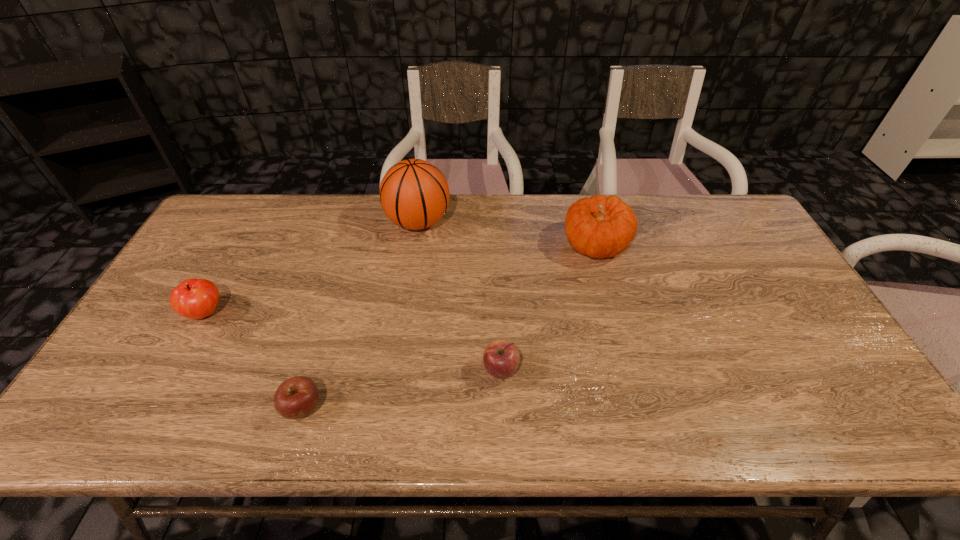
Where is `free space at the left edge of the desktop`? The width and height of the screenshot is (960, 540). free space at the left edge of the desktop is located at coordinates tap(173, 351).

In order to click on free region at the right edge of the desktop in this screenshot , I will do `click(757, 296)`.

Where is `free space at the far right corner of the desktop`? This screenshot has width=960, height=540. free space at the far right corner of the desktop is located at coordinates (732, 196).

This screenshot has height=540, width=960. I want to click on vacant area between the rightmost apple and the farthest apple, so click(x=353, y=341).

Locate an element on the screen. vacant region between the rightmost object and the third nearest object is located at coordinates (400, 279).

Locate an element on the screen. free space between the basketball and the leftmost object is located at coordinates (312, 267).

Locate an element on the screen. The image size is (960, 540). empty space that is in between the shortest object and the third object from left to right is located at coordinates (361, 315).

The height and width of the screenshot is (540, 960). Find the location of `vacant area between the leftmost apple and the nearest object`. vacant area between the leftmost apple and the nearest object is located at coordinates coord(254,360).

Locate an element on the screen. The height and width of the screenshot is (540, 960). vacant region between the basketball and the rightmost apple is located at coordinates (460, 296).

I want to click on free space that is in between the third object from right to left and the fourth shortest object, so click(507, 233).